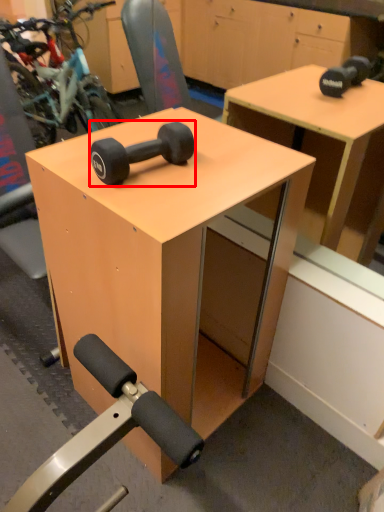
Question: From the image, what is the correct spatial relationship of dumbbell (annotated by the red box) in relation to table?

Choices:
 (A) right
 (B) left

Answer: (B)